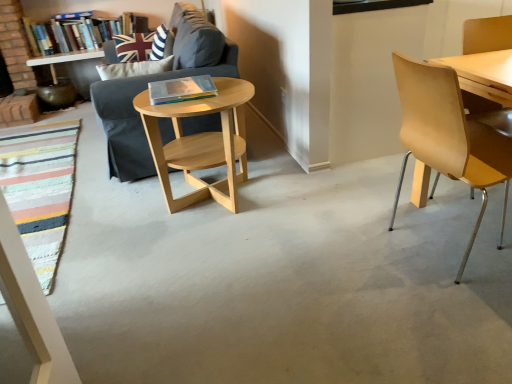
I want to click on vacant space in front of light wood/woodenobject at center, so click(x=198, y=263).